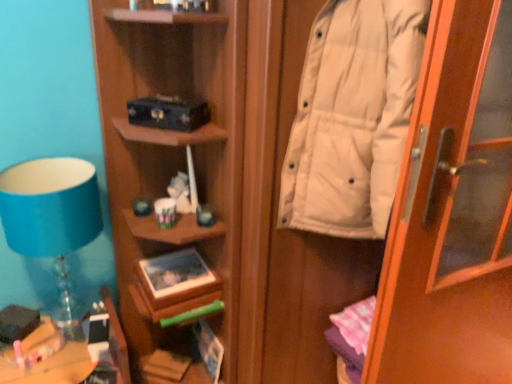
You are a GUI agent. You are given a task and a screenshot of the screen. Output one action in this format:
    pyautogui.click(x=<x>, y=<y>)
    Task: Click on the vacant space underneath matte black book at upper center, which is counted as the fourth book, starting from the bottom (from a real-world perspective)
    This screenshot has width=512, height=384.
    Given the screenshot: What is the action you would take?
    pyautogui.click(x=172, y=261)